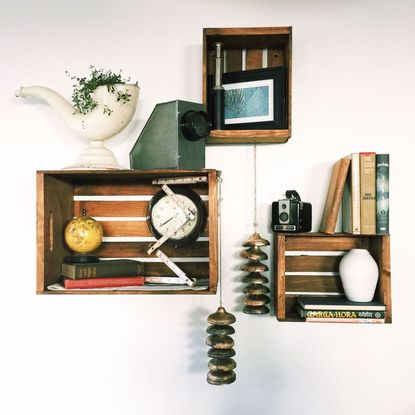
This screenshot has width=415, height=415. Identify the location of shelf. (214, 248).